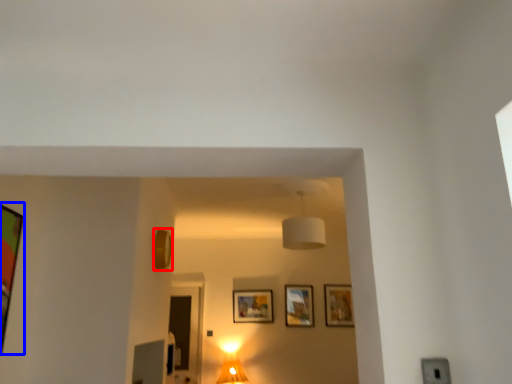
Question: Among these objects, which one is nearest to the camera, picture frame (highlighted by a red box) or picture frame (highlighted by a blue box)?

Choices:
 (A) picture frame
 (B) picture frame

Answer: (B)